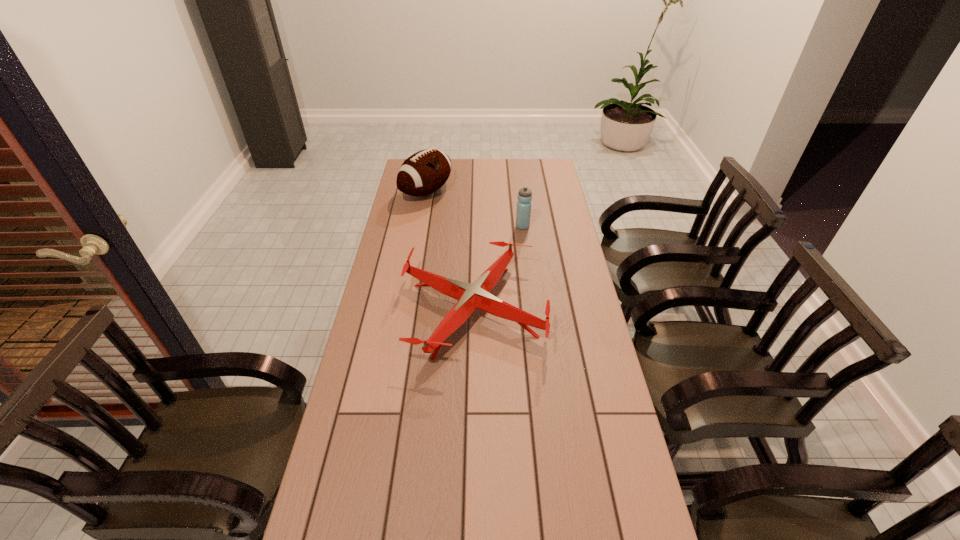
At what (x,y) coordinates should I click in order to perform the action: click on object at the right edge. Please return your answer as a coordinate pair (x, y). Image resolution: width=960 pixels, height=540 pixels. Looking at the image, I should click on (470, 297).

At what (x,y) coordinates should I click in order to perform the action: click on object that is at the far left corner. Please return your answer as a coordinate pair (x, y). Looking at the image, I should click on (423, 173).

Where is `free space at the far edge of the desktop`? free space at the far edge of the desktop is located at coordinates (499, 173).

Image resolution: width=960 pixels, height=540 pixels. What are the coordinates of `free spot at the left edge of the desktop` in the screenshot? It's located at (396, 214).

At what (x,y) coordinates should I click in order to perform the action: click on free space at the right edge. Please return your answer as a coordinate pair (x, y). Looking at the image, I should click on (623, 468).

Where is `free space between the football (American) and the second farthest object`? The height and width of the screenshot is (540, 960). free space between the football (American) and the second farthest object is located at coordinates (474, 210).

The image size is (960, 540). Identify the location of free space between the farthest object and the water bottle. (474, 210).

This screenshot has width=960, height=540. Identify the location of vacant region between the shortest object and the football (American). (450, 251).

At what (x,y) coordinates should I click in order to perform the action: click on vacant area that lies between the football (American) and the nearest object. Please return your answer as a coordinate pair (x, y). Looking at the image, I should click on (450, 251).

Identify the location of the second closest object relative to the second farthest object. (423, 173).